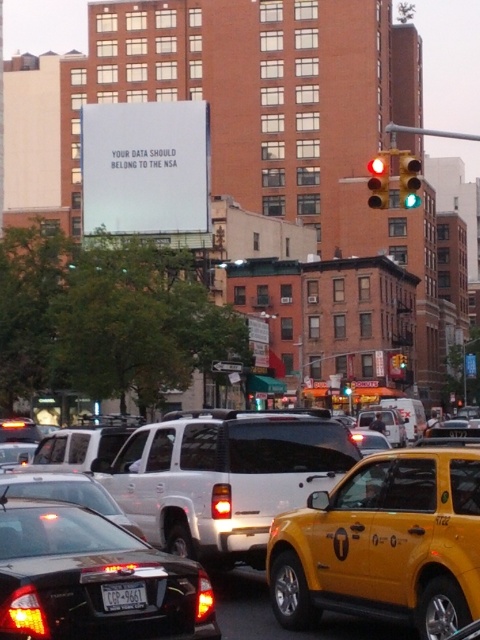
Question: Which point appears farthest from the camera in this image?

Choices:
 (A) (149, 476)
 (B) (349, 388)
 (C) (386, 177)
 (D) (190, 592)

Answer: (B)

Question: Can you confirm if matte white suv at center is smaller than glassy red traffic light at upper center?

Choices:
 (A) no
 (B) yes

Answer: (A)

Question: Which point appears closest to the camera in this image?

Choices:
 (A) (396, 506)
 (B) (128, 531)
 (C) (399, 170)
 (D) (371, 506)

Answer: (B)

Question: Can you confirm if matte white suv at center is positioned to the left of white plastic license plate at center?

Choices:
 (A) no
 (B) yes

Answer: (B)

Question: Is yellow matte taxi cab at center thinner than white paper at upper center?

Choices:
 (A) no
 (B) yes

Answer: (B)

Question: Considering the real-world distances, which object is closest to the white paper at upper center?

Choices:
 (A) green glass traffic light at upper right
 (B) white plastic license plate at center

Answer: (A)